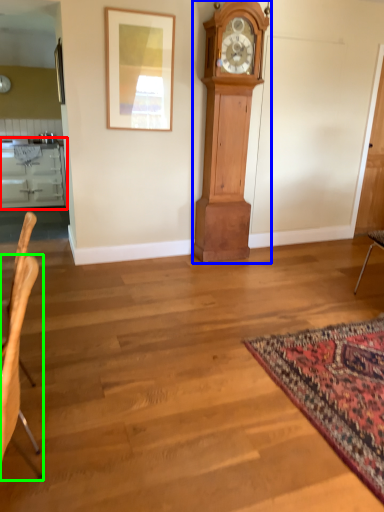
Question: Which object is the farthest from cabinetry (highlighted by a red box)? Choose among these: wall clock (highlighted by a blue box) or chair (highlighted by a green box).

Choices:
 (A) wall clock
 (B) chair

Answer: (B)